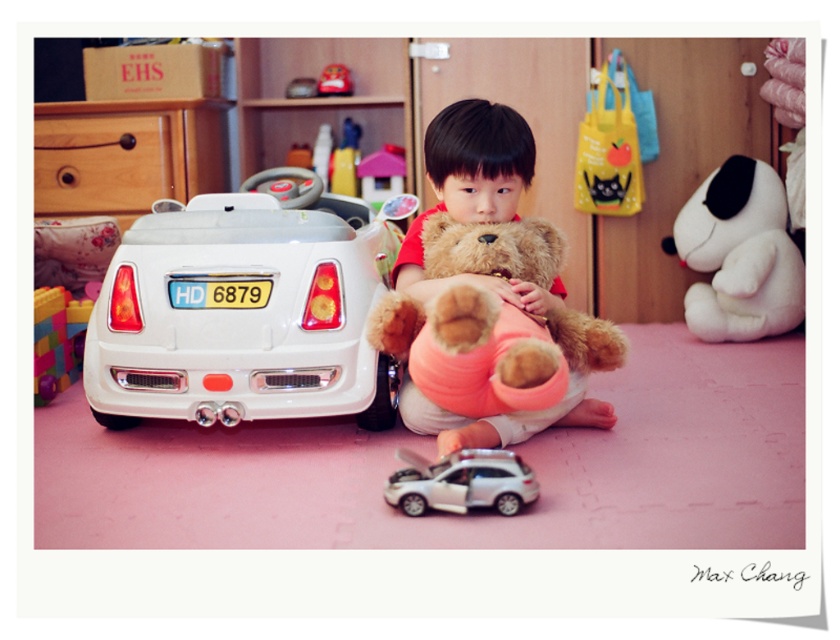
You are a parent trying to locate your child who is sitting on the floor holding the brown plush teddy bear at center. The child is facing the white toy car with license plate HD 6879 on the left. Can you determine the direction the child is facing relative to the teddy bear?

The child is facing the white toy car with license plate HD 6879, which is located to the left of the brown plush teddy bear at center. Therefore, the child is facing to the left relative to the teddy bear.

You are a parent trying to organize the playroom. You want to place the multicolored plastic blocks at left on a lower shelf and the brown plush teddy bear at center on a higher shelf. Based on their positions in the image, will the teddy bear block the view of the blocks from the front?

The brown plush teddy bear at center is positioned over the multicolored plastic blocks at left, so it will block the view of the blocks from the front.

You are a parent trying to find your child a toy car to play with. The child is sitting on the floor holding a teddy bear. Where is the white matte toy car at left in relation to the child?

The white matte toy car at left is located to the left of the child, positioned on a pink mat at coordinates approximately 0.489 on the x and 0.292 on the y axis.